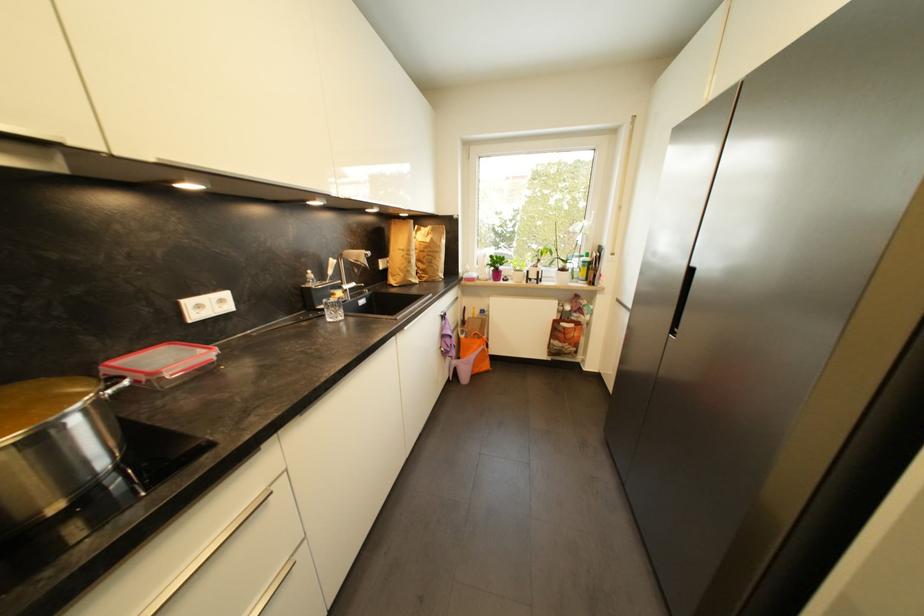
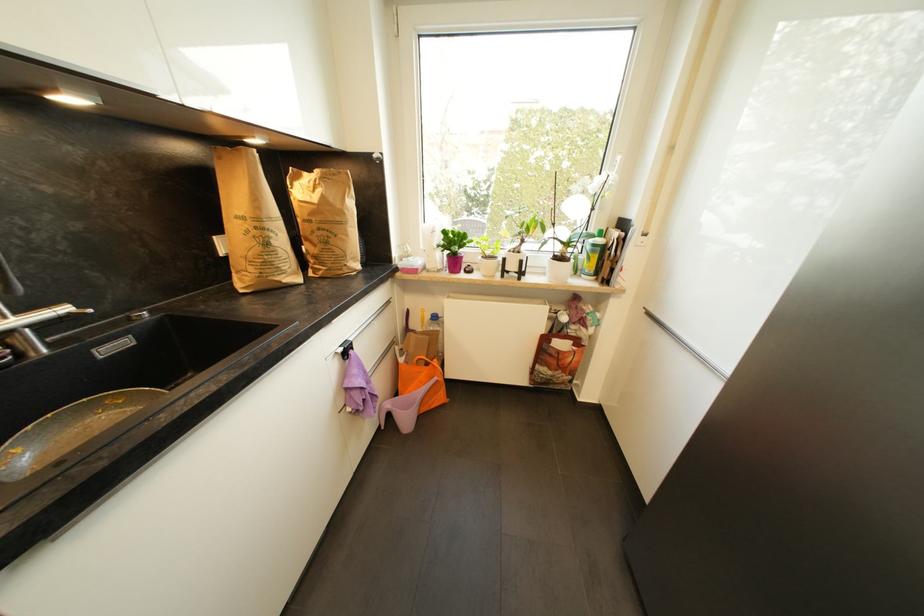
In the second image, find the point that corresponds to the point at 495,257 in the first image.

(450, 233)